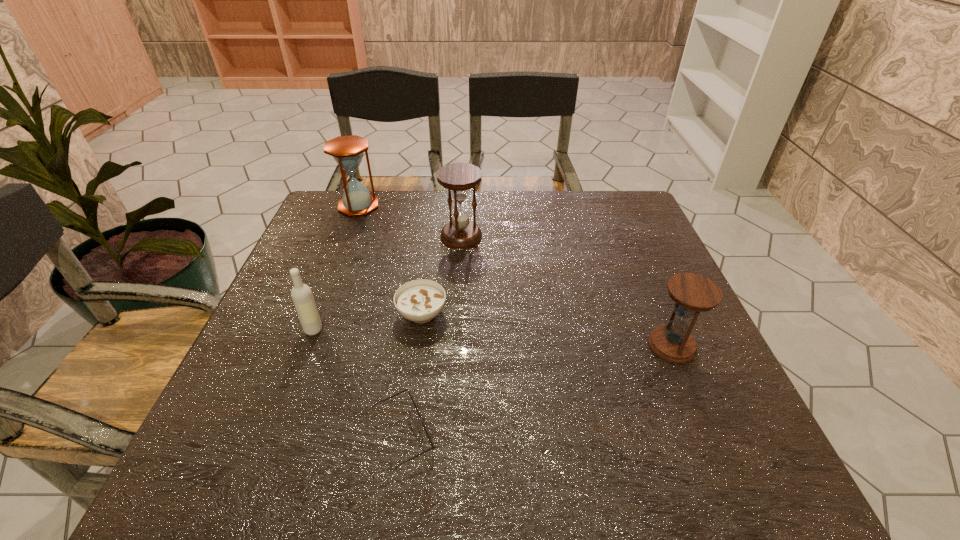
At what (x,y) coordinates should I click in order to perform the action: click on the farthest hourglass. Please return your answer as a coordinate pair (x, y). The image size is (960, 540). Looking at the image, I should click on (347, 151).

Where is `the farthest object`? This screenshot has height=540, width=960. the farthest object is located at coordinates (347, 151).

You are a GUI agent. You are given a task and a screenshot of the screen. Output one action in this format:
    pyautogui.click(x=<x>, y=<y>)
    Task: Click on the second nearest hourglass
    
    Given the screenshot: What is the action you would take?
    pyautogui.click(x=461, y=233)

Image resolution: width=960 pixels, height=540 pixels. In order to click on the second hourglass from left to right in this screenshot , I will do `click(461, 233)`.

Where is `vodka`? vodka is located at coordinates (301, 294).

What are the coordinates of `the rightmost object` in the screenshot? It's located at (692, 293).

The image size is (960, 540). What are the coordinates of `the rightmost hourglass` in the screenshot? It's located at (692, 293).

Image resolution: width=960 pixels, height=540 pixels. Identify the location of soup bowl. (420, 301).

Where is `the shortest object`? the shortest object is located at coordinates (426, 431).

Identify the location of spectacles. 426,431.